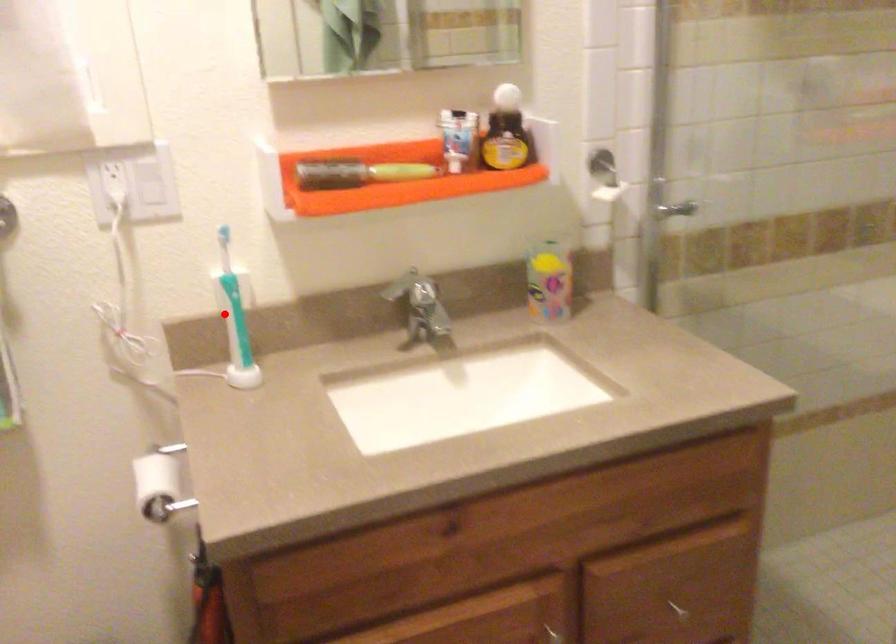
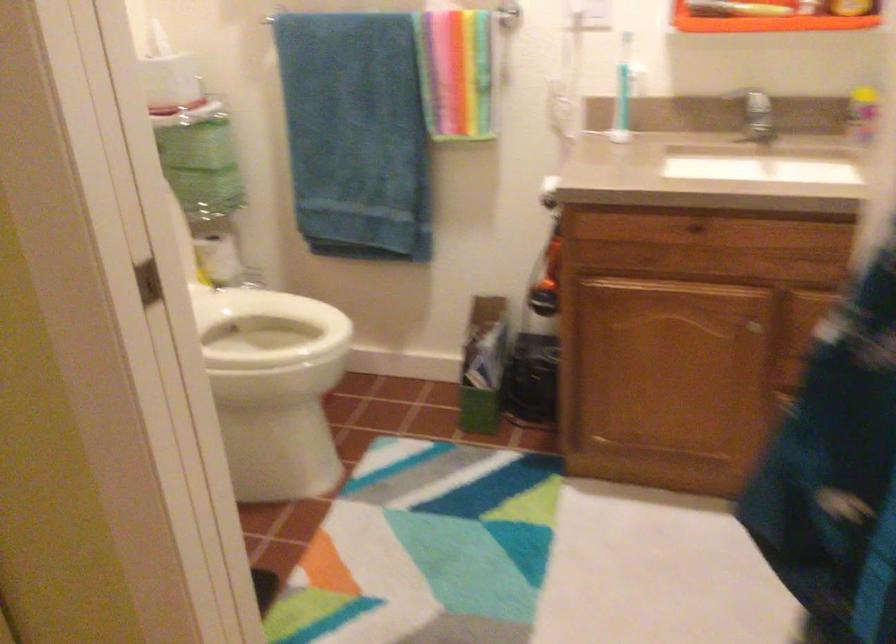
Locate, in the second image, the point that corresponds to the highlighted location in the first image.

(623, 91)